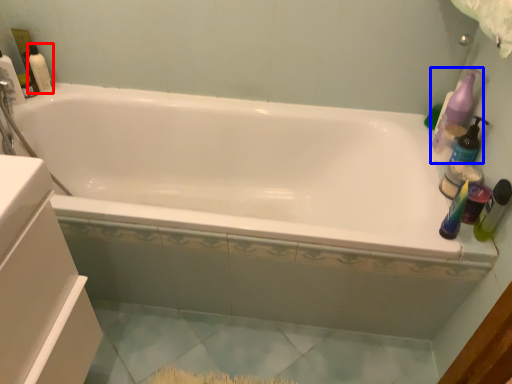
Question: Among these objects, which one is farthest to the camera, cleaning product (highlighted by a red box) or cleaning product (highlighted by a blue box)?

Choices:
 (A) cleaning product
 (B) cleaning product

Answer: (A)